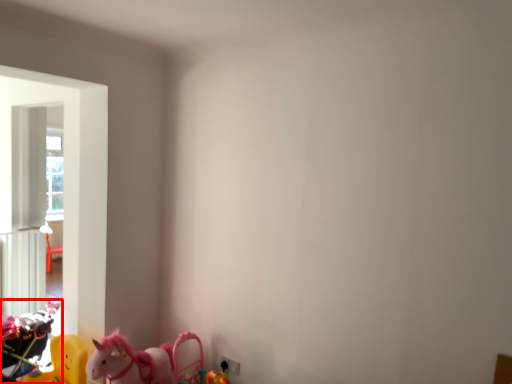
Question: From the image's perspective, where is toy (annotated by the red box) located relative to toy?

Choices:
 (A) below
 (B) above

Answer: (B)